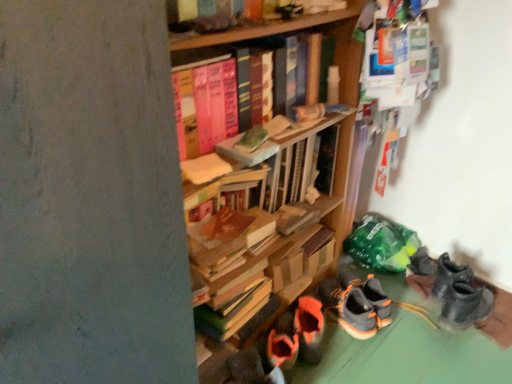
At what (x,y) coordinates should I click in order to perform the action: click on free space in front of gray suede sneakers at lower center. Please return your answer as a coordinate pair (x, y). The height and width of the screenshot is (384, 512). Looking at the image, I should click on (359, 353).